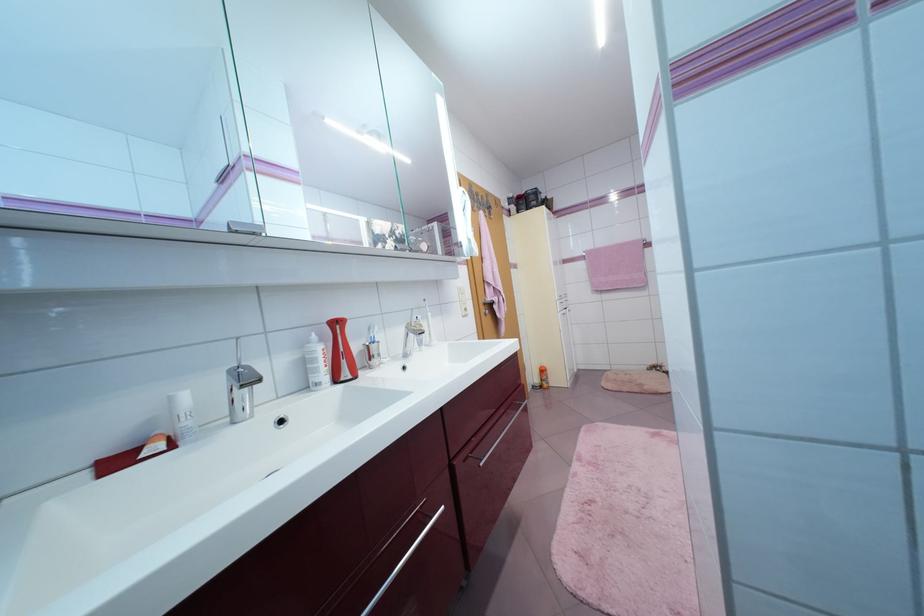
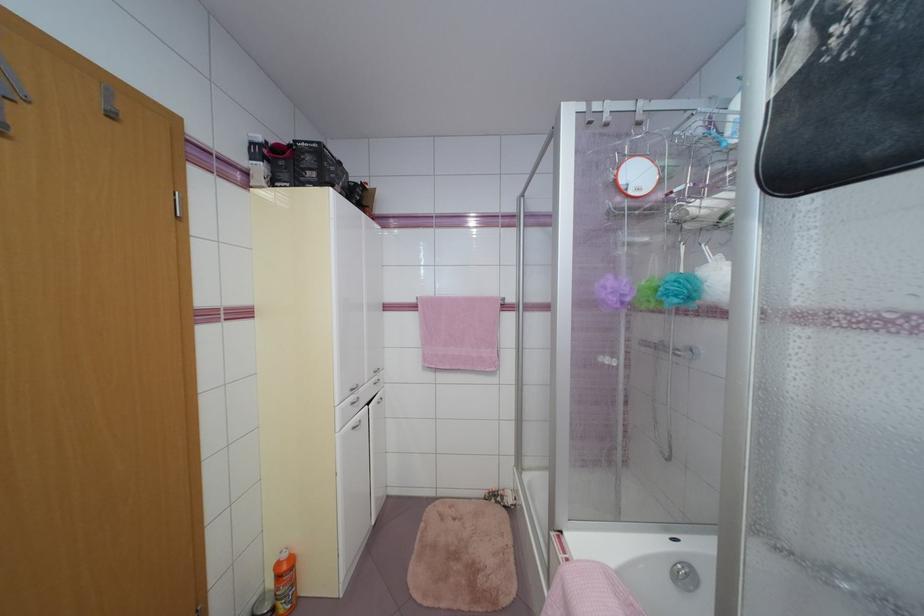
Locate, in the second image, the point that corresponds to the point at 551,387 in the first image.

(287, 610)